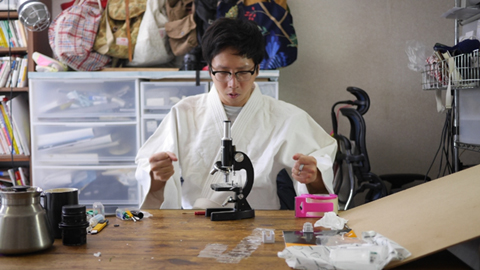
Where is `white wall`? white wall is located at coordinates (350, 50).